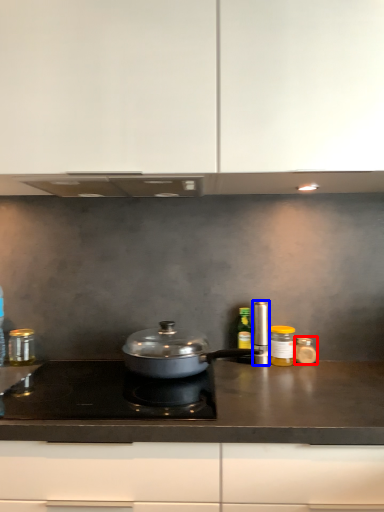
Question: Among these objects, which one is nearest to the camera, kitchen appliance (highlighted by a red box) or kitchen appliance (highlighted by a blue box)?

Choices:
 (A) kitchen appliance
 (B) kitchen appliance

Answer: (B)